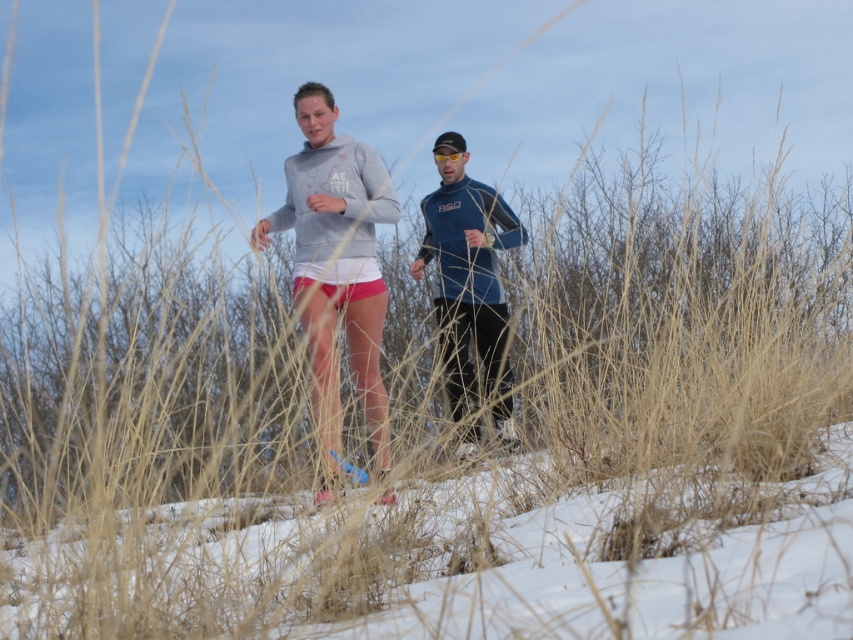
Can you confirm if matte gray hoodie at center is wider than blue matte running suit at center?

Yes.

Between point (292, 224) and point (436, 241), which one is positioned behind?

Positioned behind is point (436, 241).

Where is `matte gray hoodie at center`? The height and width of the screenshot is (640, 853). matte gray hoodie at center is located at coordinates (335, 268).